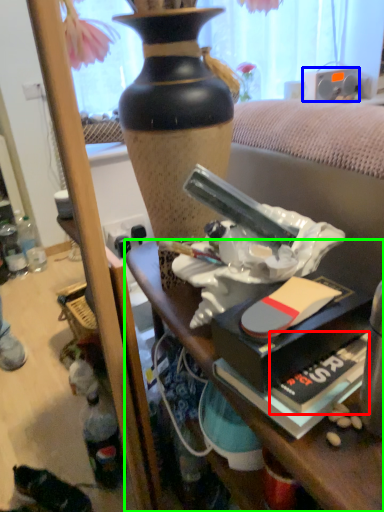
Question: Estimate the real-world distances between objects in this image. Which object is closer to paperback book (highlighted by a red box), loudspeaker (highlighted by a blue box) or desk (highlighted by a green box)?

Choices:
 (A) loudspeaker
 (B) desk

Answer: (B)